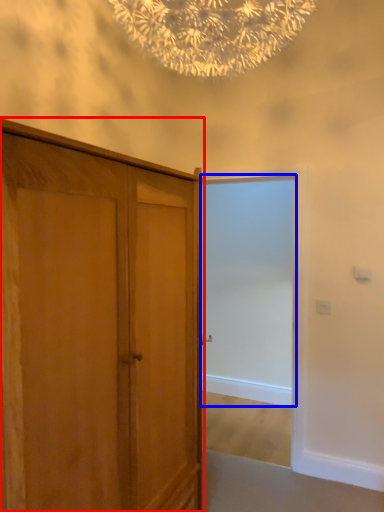
Question: Which object is closer to the camera taking this photo, cupboard (highlighted by a red box) or screen door (highlighted by a blue box)?

Choices:
 (A) cupboard
 (B) screen door

Answer: (A)